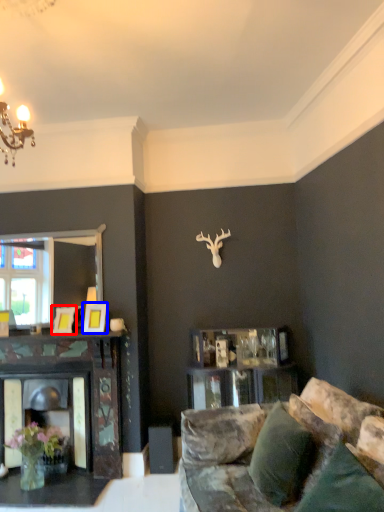
Question: Among these objects, which one is nearest to the camera, picture frame (highlighted by a red box) or picture frame (highlighted by a blue box)?

Choices:
 (A) picture frame
 (B) picture frame

Answer: (B)